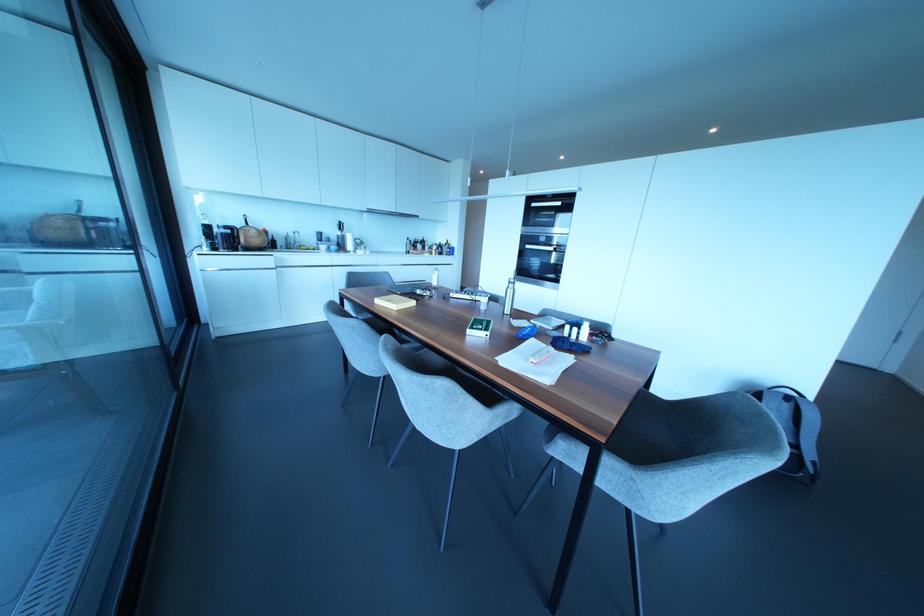
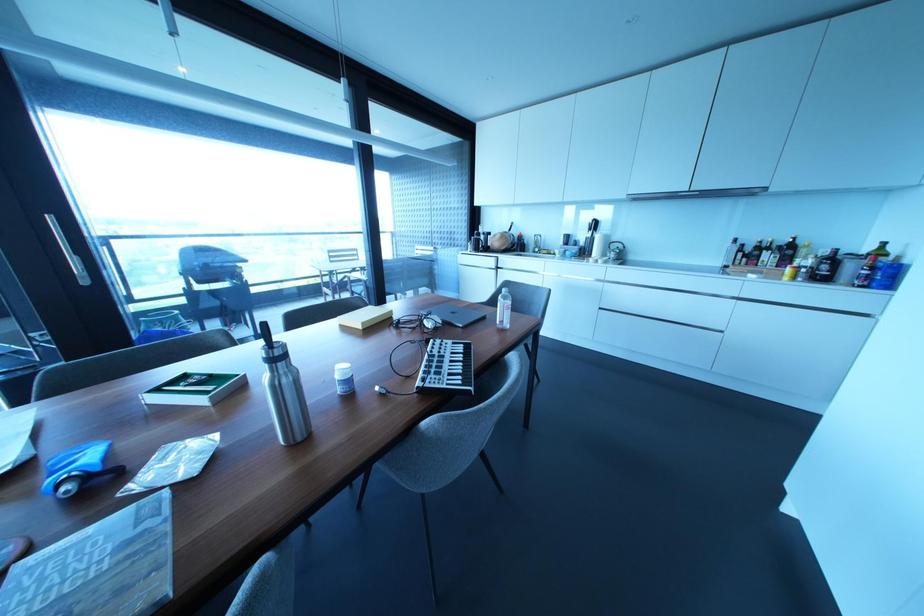
Find the pixel in the second image that matches point 358,241 in the first image.

(614, 245)